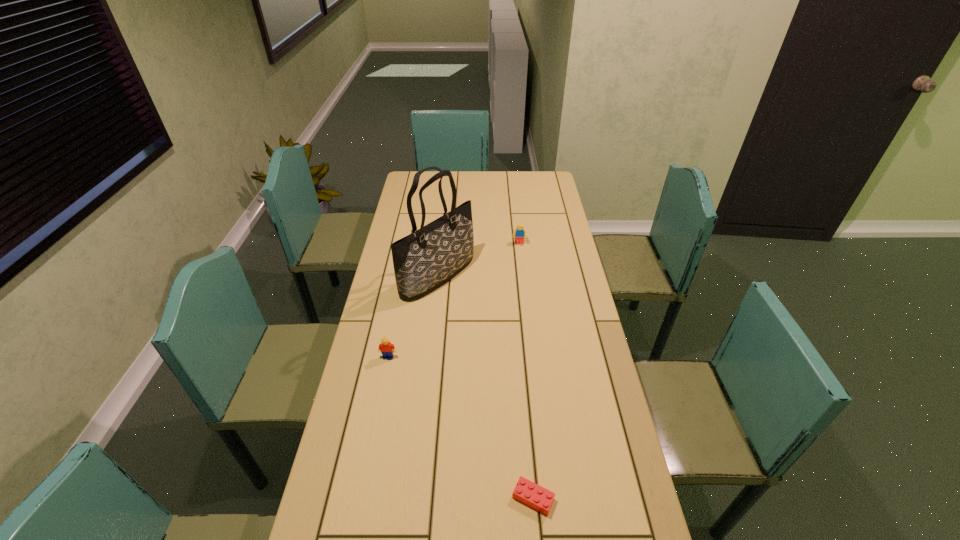
The width and height of the screenshot is (960, 540). What are the coordinates of `free space between the farthest object and the leftmost Lego` in the screenshot? It's located at (454, 300).

The height and width of the screenshot is (540, 960). I want to click on free point between the nearest object and the farthest object, so click(526, 371).

Locate an element on the screen. vacant area that lies between the tallest object and the nearest object is located at coordinates (486, 387).

This screenshot has height=540, width=960. Identify the location of vacant region between the nearest Lego and the leftmost Lego. (461, 428).

Image resolution: width=960 pixels, height=540 pixels. Find the location of `free space between the farthest Lego and the nearest Lego`. free space between the farthest Lego and the nearest Lego is located at coordinates (526, 371).

Find the location of a particular element. Image resolution: width=960 pixels, height=540 pixels. vacant area between the tote bag and the farthest Lego is located at coordinates (478, 260).

At what (x,y) coordinates should I click in order to perform the action: click on empty space that is in between the third farthest object and the third nearest object. Please return your answer as a coordinate pair (x, y). This screenshot has width=960, height=540. Looking at the image, I should click on point(413,316).

Locate which object is the second closest to the third farthest object. Please provide its 2D coordinates. Your answer should be formatted as a tuple, i.e. [(x, y)], where the tuple contains the x and y coordinates of a point satisfying the conditions above.

[(527, 492)]

Locate which object ranks in proximity to the tote bag. Please provide its 2D coordinates. Your answer should be formatted as a tuple, i.e. [(x, y)], where the tuple contains the x and y coordinates of a point satisfying the conditions above.

[(519, 233)]

The image size is (960, 540). In order to click on Lego that is the second closest to the tote bag in this screenshot , I will do tap(387, 349).